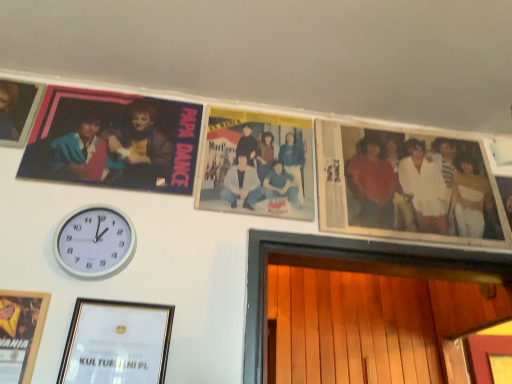
Question: From the image's perspective, would you say matte plastic photo frame at upper left, which is counted as the 3th picture frame, starting from the bottom, is positioned over matte black photo frame at upper left, which is the fourth picture frame from bottom to top?

Choices:
 (A) no
 (B) yes

Answer: (A)

Question: Does matte plastic photo frame at upper left, the 2th picture frame when ordered from top to bottom, appear on the right side of matte black photo frame at upper left, positioned as the first picture frame in top-to-bottom order?

Choices:
 (A) yes
 (B) no

Answer: (A)

Question: Can you confirm if matte plastic photo frame at upper left, the 2th picture frame when ordered from top to bottom, is bigger than matte black photo frame at upper left, which is the fourth picture frame from bottom to top?

Choices:
 (A) no
 (B) yes

Answer: (B)

Question: Is matte plastic photo frame at upper left, which is counted as the 3th picture frame, starting from the bottom, aimed at matte black photo frame at upper left, positioned as the first picture frame in top-to-bottom order?

Choices:
 (A) yes
 (B) no

Answer: (B)

Question: Considering the relative positions of matte plastic photo frame at upper left, the 2th picture frame when ordered from top to bottom, and matte black photo frame at upper left, which is the fourth picture frame from bottom to top, in the image provided, is matte plastic photo frame at upper left, the 2th picture frame when ordered from top to bottom, behind matte black photo frame at upper left, which is the fourth picture frame from bottom to top,?

Choices:
 (A) yes
 (B) no

Answer: (B)

Question: Considering the positions of matte black photo frame at upper left, positioned as the first picture frame in top-to-bottom order, and white cotton shirt at right in the image, is matte black photo frame at upper left, positioned as the first picture frame in top-to-bottom order, wider or thinner than white cotton shirt at right?

Choices:
 (A) thin
 (B) wide

Answer: (B)

Question: From a real-world perspective, relative to white cotton shirt at right, is matte black photo frame at upper left, positioned as the first picture frame in top-to-bottom order, vertically above or below?

Choices:
 (A) above
 (B) below

Answer: (A)

Question: Is matte black photo frame at upper left, which is the fourth picture frame from bottom to top, bigger or smaller than white cotton shirt at right?

Choices:
 (A) big
 (B) small

Answer: (B)

Question: Is point (11, 97) closer or farther from the camera than point (360, 185)?

Choices:
 (A) farther
 (B) closer

Answer: (B)

Question: In terms of width, does wooden picture frame at lower left, arranged as the 3th picture frame when viewed from the top, look wider or thinner when compared to white plastic wall clock at lower left?

Choices:
 (A) wide
 (B) thin

Answer: (B)

Question: Visually, is wooden picture frame at lower left, arranged as the 3th picture frame when viewed from the top, positioned to the left or to the right of white plastic wall clock at lower left?

Choices:
 (A) right
 (B) left

Answer: (B)

Question: From the image's perspective, is wooden picture frame at lower left, which is counted as the 2th picture frame, starting from the bottom, located above or below white plastic wall clock at lower left?

Choices:
 (A) above
 (B) below

Answer: (B)

Question: Is point (5, 334) closer or farther from the camera than point (71, 235)?

Choices:
 (A) farther
 (B) closer

Answer: (B)

Question: Considering the positions of point (69, 132) and point (360, 200), is point (69, 132) closer or farther from the camera than point (360, 200)?

Choices:
 (A) farther
 (B) closer

Answer: (B)

Question: Do you think matte plastic photo frame at upper left, which is counted as the 3th picture frame, starting from the bottom, is within white cotton shirt at right, or outside of it?

Choices:
 (A) outside
 (B) inside

Answer: (A)